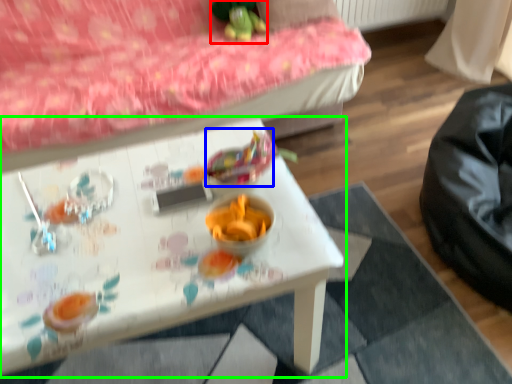
Question: Which object is positioned farthest from toy (highlighted by a red box)? Select from food (highlighted by a blue box) and table (highlighted by a green box).

Choices:
 (A) food
 (B) table

Answer: (B)